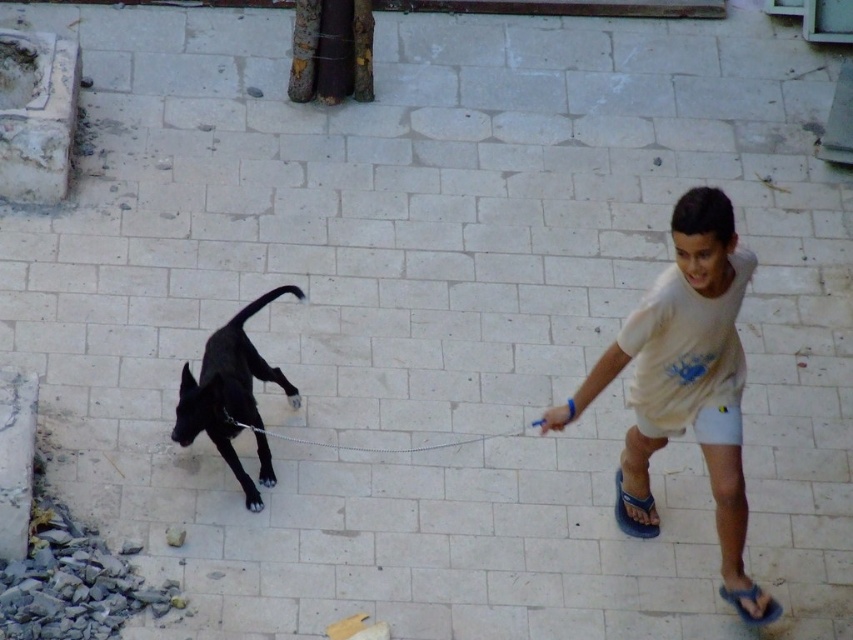
Is white cotton shirt at right thinner than black glossy dog at lower left?

In fact, white cotton shirt at right might be wider than black glossy dog at lower left.

Is white cotton shirt at right shorter than black glossy dog at lower left?

No, white cotton shirt at right is not shorter than black glossy dog at lower left.

I want to click on white cotton shirt at right, so click(x=686, y=384).

Which is below, white cotton shirt at right or silver chain leash at center?

silver chain leash at center is below.

Between point (730, 388) and point (396, 451), which one is positioned behind?

The point (396, 451) is behind.

Measure the distance between white cotton shirt at right and camera.

A distance of 8.87 meters exists between white cotton shirt at right and camera.

Where is `white cotton shirt at right`? white cotton shirt at right is located at coordinates (686, 384).

Which is above, black glossy dog at lower left or silver chain leash at center?

black glossy dog at lower left

Measure the distance between black glossy dog at lower left and camera.

black glossy dog at lower left is 10.15 meters away from camera.

Locate an element on the screen. Image resolution: width=853 pixels, height=640 pixels. black glossy dog at lower left is located at coordinates (231, 396).